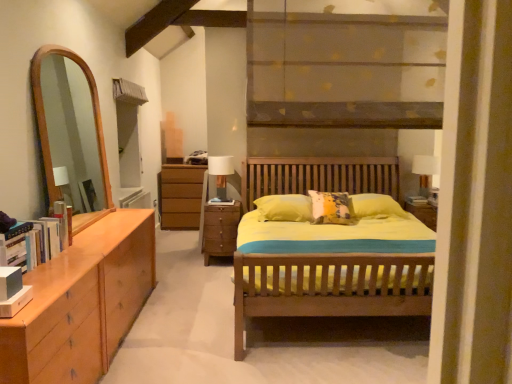
Question: Can you confirm if white glossy table lamp at right, placed as the first table lamp when sorted from right to left, is taller than matte white table lamp at center, arranged as the second table lamp when viewed from the right?

Choices:
 (A) yes
 (B) no

Answer: (B)

Question: From a real-world perspective, does white glossy table lamp at right, placed as the first table lamp when sorted from right to left, stand above matte white table lamp at center, the first table lamp in the left-to-right sequence?

Choices:
 (A) yes
 (B) no

Answer: (B)

Question: Is white glossy table lamp at right, positioned as the second table lamp in left-to-right order, turned away from matte white table lamp at center, the first table lamp in the left-to-right sequence?

Choices:
 (A) no
 (B) yes

Answer: (A)

Question: From a real-world perspective, is white glossy table lamp at right, placed as the first table lamp when sorted from right to left, beneath matte white table lamp at center, the first table lamp in the left-to-right sequence?

Choices:
 (A) yes
 (B) no

Answer: (A)

Question: Does white glossy table lamp at right, positioned as the second table lamp in left-to-right order, have a smaller size compared to matte white table lamp at center, the first table lamp in the left-to-right sequence?

Choices:
 (A) no
 (B) yes

Answer: (B)

Question: Is white glossy table lamp at right, placed as the first table lamp when sorted from right to left, thinner than matte white table lamp at center, arranged as the second table lamp when viewed from the right?

Choices:
 (A) no
 (B) yes

Answer: (B)

Question: Is white glossy table lamp at right, positioned as the second table lamp in left-to-right order, in front of brown wooden chest of drawers at center?

Choices:
 (A) no
 (B) yes

Answer: (A)

Question: Is white glossy table lamp at right, positioned as the second table lamp in left-to-right order, oriented towards brown wooden chest of drawers at center?

Choices:
 (A) no
 (B) yes

Answer: (A)

Question: Are white glossy table lamp at right, placed as the first table lamp when sorted from right to left, and brown wooden chest of drawers at center making contact?

Choices:
 (A) yes
 (B) no

Answer: (B)

Question: Does white glossy table lamp at right, positioned as the second table lamp in left-to-right order, have a larger size compared to brown wooden chest of drawers at center?

Choices:
 (A) yes
 (B) no

Answer: (B)

Question: Is white glossy table lamp at right, placed as the first table lamp when sorted from right to left, to the left of brown wooden chest of drawers at center from the viewer's perspective?

Choices:
 (A) yes
 (B) no

Answer: (B)

Question: From a real-world perspective, is white glossy table lamp at right, placed as the first table lamp when sorted from right to left, positioned under brown wooden chest of drawers at center based on gravity?

Choices:
 (A) yes
 (B) no

Answer: (B)

Question: Can you confirm if brown wooden chest of drawers at center is taller than matte brown wooden shelf at upper center?

Choices:
 (A) no
 (B) yes

Answer: (A)